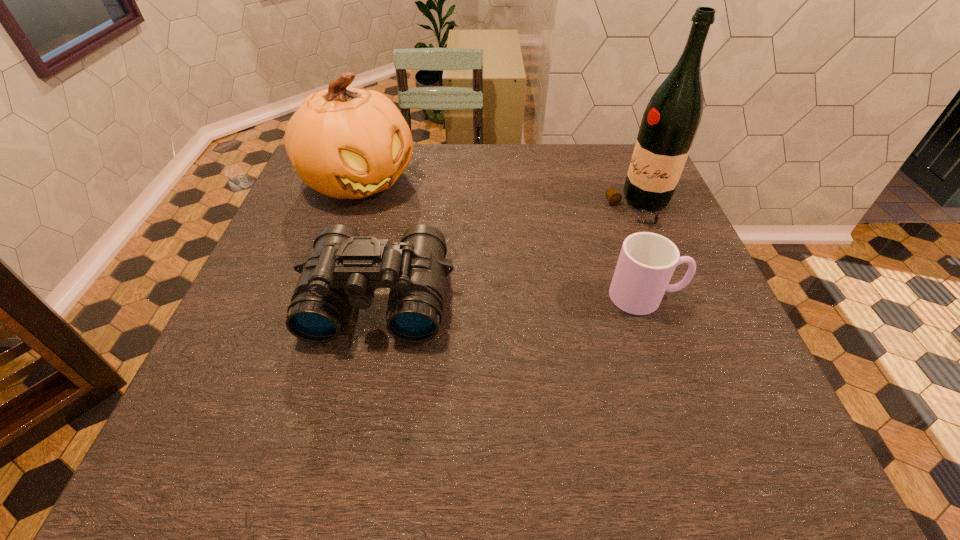
Where is `vacant region located 0.060m on the surface of the tallest object`? The width and height of the screenshot is (960, 540). vacant region located 0.060m on the surface of the tallest object is located at coordinates (604, 230).

This screenshot has height=540, width=960. I want to click on pumpkin at the far edge, so click(348, 143).

The height and width of the screenshot is (540, 960). I want to click on wine bottle that is at the far edge, so click(x=670, y=122).

I want to click on binoculars present at the left edge, so click(344, 269).

In order to click on pumpkin at the left edge in this screenshot , I will do `click(348, 143)`.

The height and width of the screenshot is (540, 960). Find the location of `cup at the right edge`. cup at the right edge is located at coordinates (647, 261).

Where is `wine bottle that is at the right edge`? wine bottle that is at the right edge is located at coordinates (670, 122).

The width and height of the screenshot is (960, 540). I want to click on object located at the far left corner, so click(348, 143).

Identify the location of object that is at the far right corner. The image size is (960, 540). (670, 122).

At what (x,y) coordinates should I click in order to perform the action: click on free space at the far edge of the desktop. Please return your answer as a coordinate pair (x, y). The image size is (960, 540). Looking at the image, I should click on (601, 185).